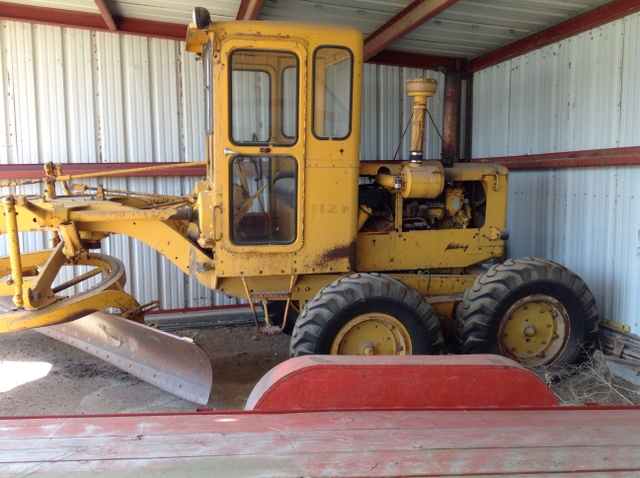
Image resolution: width=640 pixels, height=478 pixels. Identify the location of glass window. (260, 176), (260, 96).